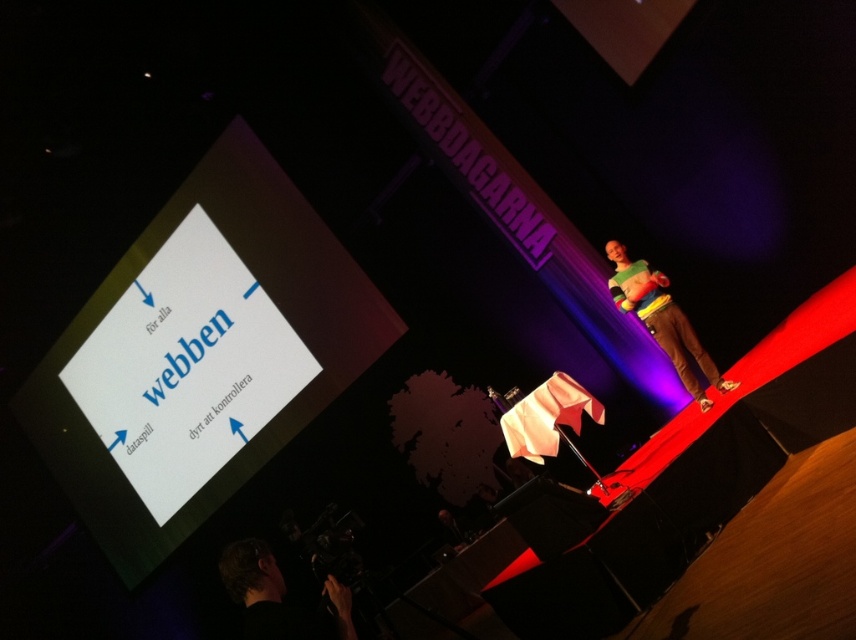
Question: Does black fabric camera at lower left have a larger size compared to multicolored sweater at right?

Choices:
 (A) yes
 (B) no

Answer: (B)

Question: Can you confirm if black fabric camera at lower left is positioned below multicolored sweater at right?

Choices:
 (A) no
 (B) yes

Answer: (B)

Question: Does black fabric camera at lower left appear on the right side of multicolored sweater at right?

Choices:
 (A) no
 (B) yes

Answer: (A)

Question: Which of the following is the farthest from the observer?

Choices:
 (A) [307, 628]
 (B) [655, 326]

Answer: (B)

Question: Which of the following is the closest to the observer?

Choices:
 (A) black fabric camera at lower left
 (B) multicolored sweater at right

Answer: (A)